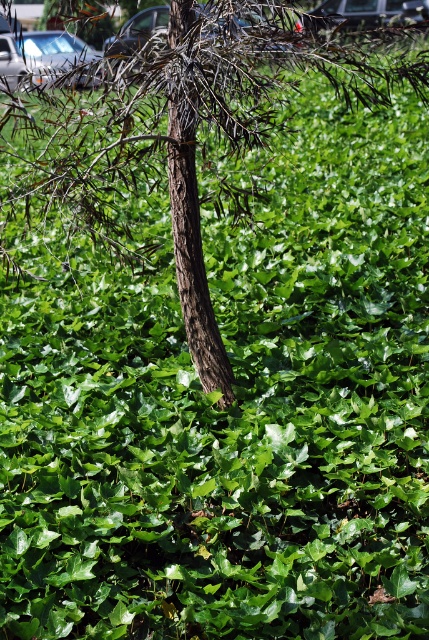
You are standing in a forest and see a tree with ivy covering it. There is a specific point at coordinates point (193, 253). What part of the tree is this point located on?

The point (193, 253) is located on the brown rough bark tree at center.

You are a landscape architect planning to place a new garden feature between the brown rough bark tree at center and the metallic silver car at upper left. Given their sizes, which object should you consider for positioning closer to the feature to ensure adequate space?

The brown rough bark tree at center is narrower than the metallic silver car at upper left, so positioning the feature closer to the tree would allow more space around the car.